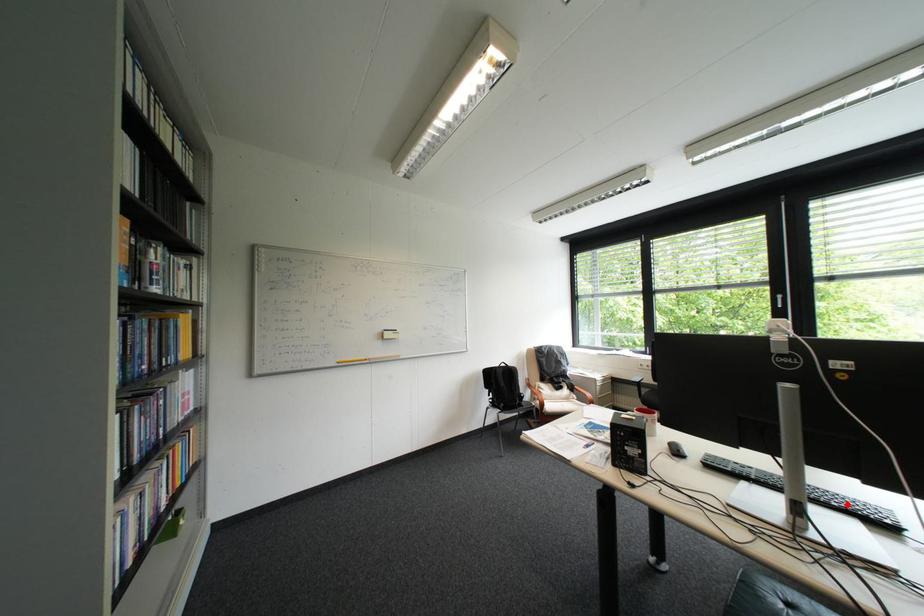
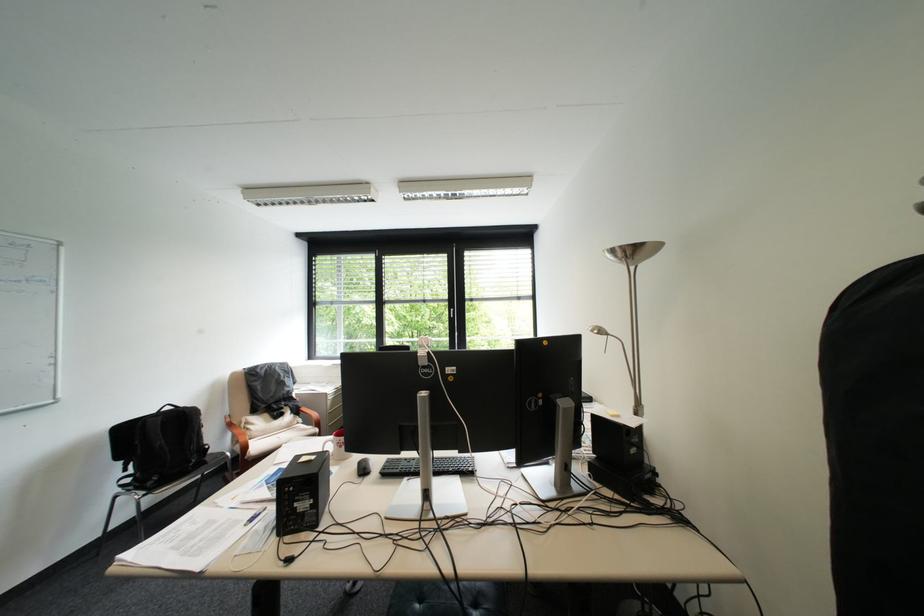
In the second image, find the point that corresponds to the highlighted location in the first image.

(463, 469)